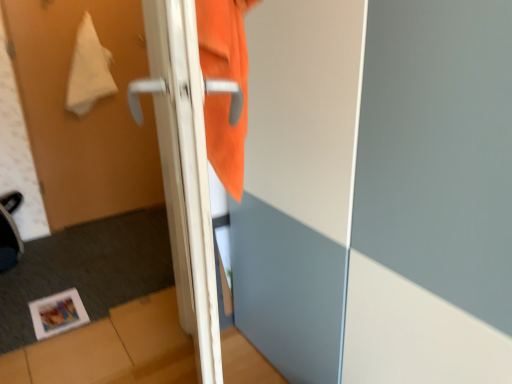
Question: From the image's perspective, does matte paper photo frame at lower left appear lower than white glossy door handle at left, the second screen door when ordered from left to right?

Choices:
 (A) no
 (B) yes

Answer: (B)

Question: Considering the relative positions of matte paper photo frame at lower left and white glossy door handle at left, the second screen door when ordered from left to right, in the image provided, is matte paper photo frame at lower left behind white glossy door handle at left, the second screen door when ordered from left to right,?

Choices:
 (A) yes
 (B) no

Answer: (A)

Question: Is matte paper photo frame at lower left taller than white glossy door handle at left, the second screen door when ordered from left to right?

Choices:
 (A) yes
 (B) no

Answer: (B)

Question: Can you confirm if matte paper photo frame at lower left is smaller than white glossy door handle at left, the second screen door from the right?

Choices:
 (A) yes
 (B) no

Answer: (A)

Question: Can white glossy door handle at left, the second screen door when ordered from left to right, be found inside matte paper photo frame at lower left?

Choices:
 (A) yes
 (B) no

Answer: (B)

Question: Is matte paper photo frame at lower left taller or shorter than white glossy door handle at left, the second screen door when ordered from left to right?

Choices:
 (A) tall
 (B) short

Answer: (B)

Question: Visually, is matte paper photo frame at lower left positioned to the left or to the right of white glossy door handle at left, the second screen door from the right?

Choices:
 (A) left
 (B) right

Answer: (A)

Question: Is matte paper photo frame at lower left inside the boundaries of white glossy door handle at left, the second screen door from the right, or outside?

Choices:
 (A) outside
 (B) inside

Answer: (A)

Question: From a real-world perspective, is matte paper photo frame at lower left physically located above or below white glossy door handle at left, the second screen door when ordered from left to right?

Choices:
 (A) above
 (B) below

Answer: (B)

Question: Visually, is white fabric towel at upper left positioned to the left or to the right of orange fabric sweatshirt at upper center?

Choices:
 (A) left
 (B) right

Answer: (A)

Question: Is point (111, 89) positioned closer to the camera than point (231, 62)?

Choices:
 (A) farther
 (B) closer

Answer: (A)

Question: In terms of width, does white fabric towel at upper left look wider or thinner when compared to orange fabric sweatshirt at upper center?

Choices:
 (A) wide
 (B) thin

Answer: (B)

Question: Looking at the image, does white fabric towel at upper left seem bigger or smaller compared to orange fabric sweatshirt at upper center?

Choices:
 (A) small
 (B) big

Answer: (B)

Question: Considering the relative positions of white glossy door handle at left, the second screen door from the right, and matte paper photo frame at lower left in the image provided, is white glossy door handle at left, the second screen door from the right, to the left or to the right of matte paper photo frame at lower left?

Choices:
 (A) left
 (B) right

Answer: (B)

Question: Considering the positions of white glossy door handle at left, the second screen door when ordered from left to right, and matte paper photo frame at lower left in the image, is white glossy door handle at left, the second screen door when ordered from left to right, wider or thinner than matte paper photo frame at lower left?

Choices:
 (A) wide
 (B) thin

Answer: (B)